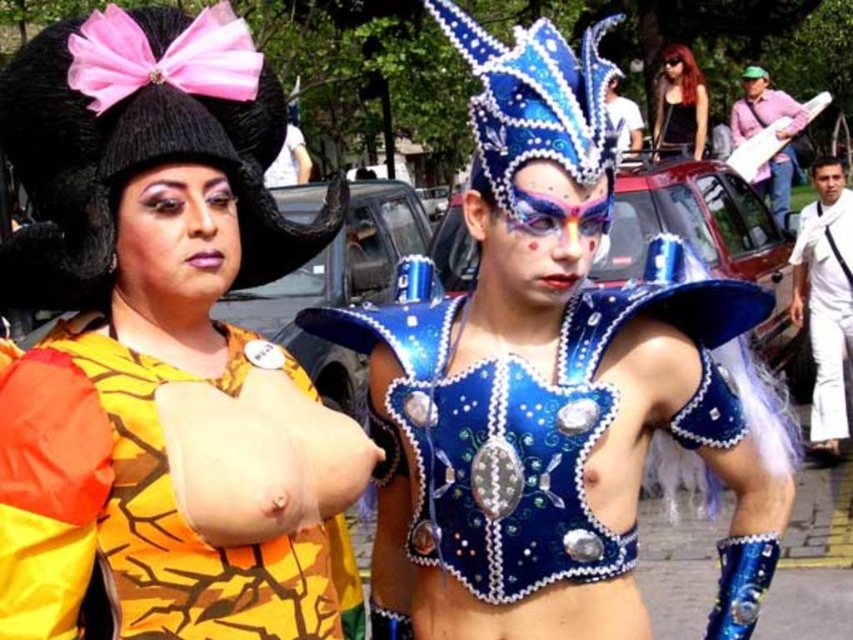
Question: Is white cotton shirt at right further to the viewer compared to white matte shirt at upper center?

Choices:
 (A) yes
 (B) no

Answer: (A)

Question: Estimate the real-world distances between objects in this image. Which object is closer to the black knitted hat with pink bow at upper left?

Choices:
 (A) matte black car at upper center
 (B) white cotton shirt at right
 (C) white matte shirt at upper center

Answer: (C)

Question: Among these points, which one is nearest to the camera?

Choices:
 (A) (776, 134)
 (B) (834, 456)
 (C) (24, 64)
 (D) (13, 356)

Answer: (D)

Question: Is yellow cracked fabric top at upper left above matte black car at upper center?

Choices:
 (A) yes
 (B) no

Answer: (B)

Question: Which of the following is the farthest from the observer?

Choices:
 (A) matte black car at upper center
 (B) white matte shirt at upper center

Answer: (A)

Question: Can you confirm if yellow cracked fabric top at upper left is positioned above yellow cracked fabric at center?

Choices:
 (A) no
 (B) yes

Answer: (B)